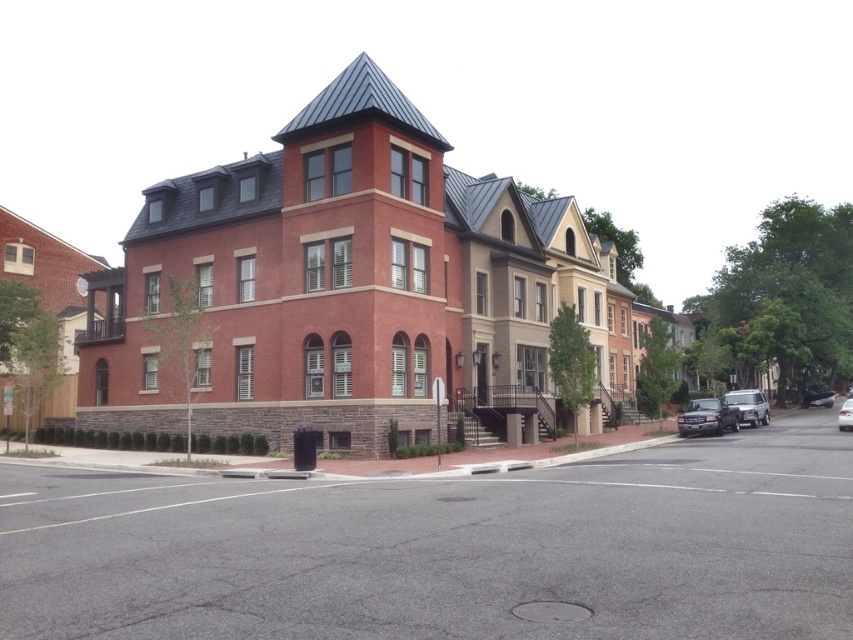
You are a delivery person driving a 15 feet long truck and need to park between the metallic silver suv at right and the metallic silver car at right. Is there enough space between them to park your truck?

The metallic silver suv at right and metallic silver car at right are 75.66 feet apart from each other. Since your truck is only 15 feet long, there is more than enough space to park between them.

You are a delivery driver who needs to park your vehicle in this area. You have a vehicle that is wider than the average car. Looking at the image, which parking spot between the metallic silver suv at right and the white glossy sedan at center would be more suitable for your wider vehicle?

The parking spot next to the metallic silver suv at right is more suitable because the metallic silver suv at right is wider than the white glossy sedan at center, indicating that the space between them can accommodate a wider vehicle.